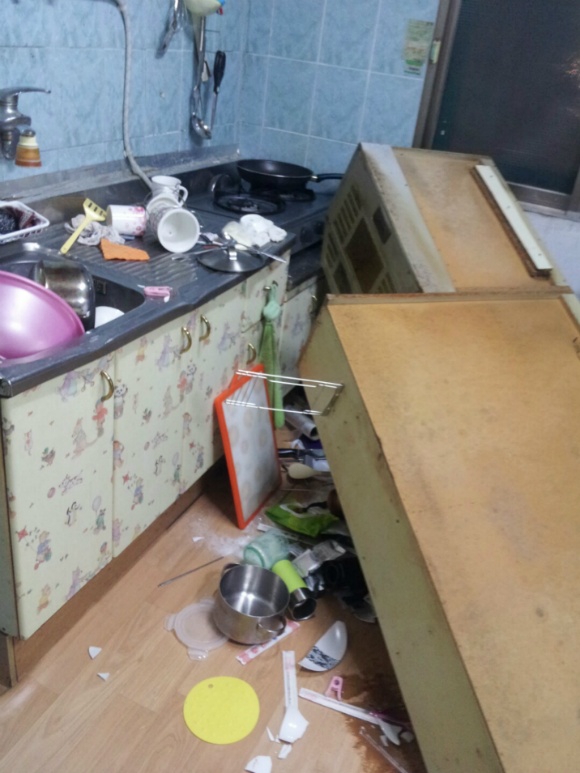
Find the location of a particular element. This screenshot has width=580, height=773. window is located at coordinates (530, 66).